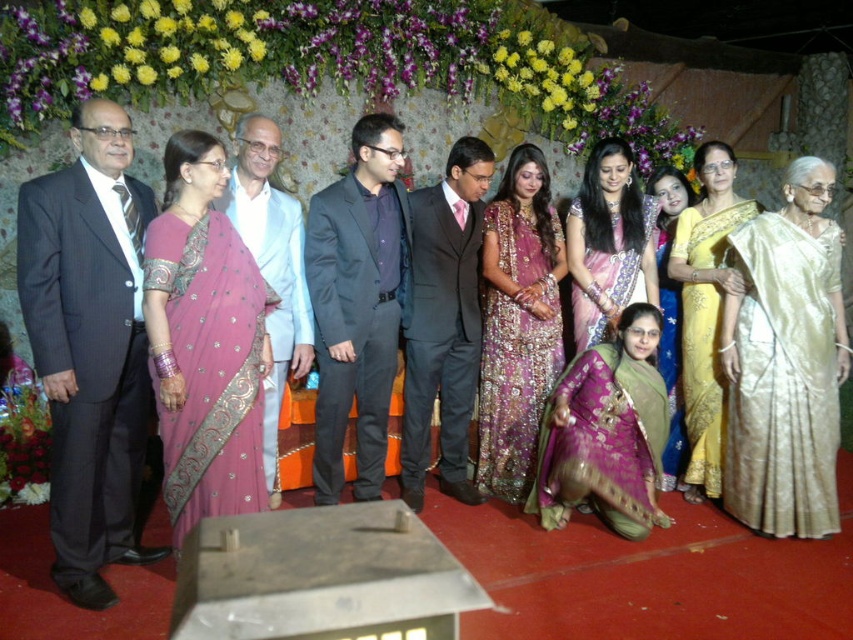
Question: Considering the relative positions of purple embroidered saree at center and purple brocade saree at center in the image provided, where is purple embroidered saree at center located with respect to purple brocade saree at center?

Choices:
 (A) left
 (B) right

Answer: (A)

Question: Is purple brocade saree at center closer to camera compared to purple satin saree at center?

Choices:
 (A) no
 (B) yes

Answer: (B)

Question: Estimate the real-world distances between objects in this image. Which object is farther from the gold silk saree at right?

Choices:
 (A) pink silk saree at center
 (B) gold silk saree at center
 (C) white silk suit at center
 (D) dark gray suit at center

Answer: (A)

Question: Which object is positioned closest to the pink silk saree at center?

Choices:
 (A) white silk suit at center
 (B) shiny black suit at center
 (C) purple embroidered saree at center
 (D) satin pink saree at center

Answer: (A)

Question: Based on their relative distances, which object is farther from the gold silk saree at center?

Choices:
 (A) dark gray suit at center
 (B) gold silk saree at right

Answer: (A)

Question: Observing the image, what is the correct spatial positioning of satin pink saree at center in reference to purple satin saree at center?

Choices:
 (A) above
 (B) below

Answer: (A)